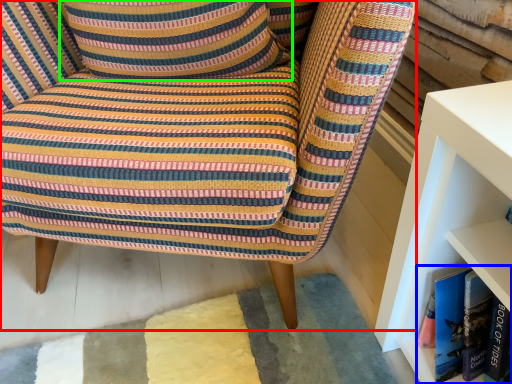
Question: Which object is positioned closest to chair (highlighted by a red box)? Select from book (highlighted by a blue box) and pillow (highlighted by a green box).

Choices:
 (A) book
 (B) pillow

Answer: (B)